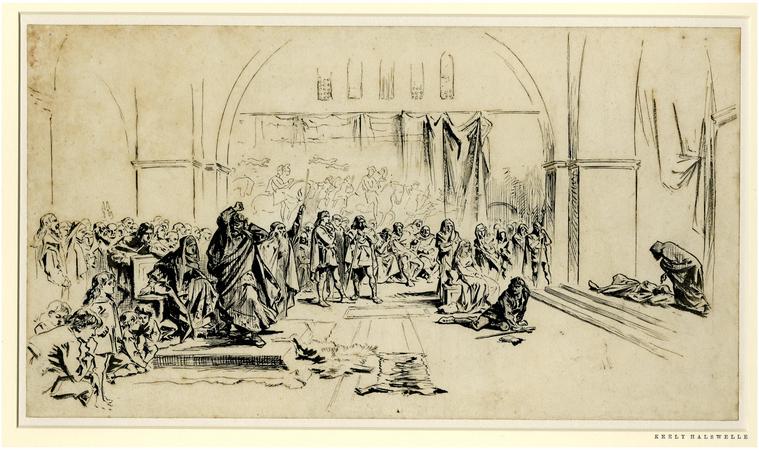
This screenshot has height=450, width=759. I want to click on drapes, so click(486, 129).